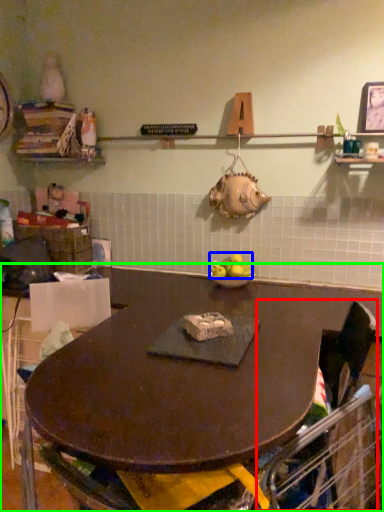
Question: Based on their relative distances, which object is farther from swivel chair (highlighted by a red box)? Choose from apple (highlighted by a blue box) and table (highlighted by a green box).

Choices:
 (A) apple
 (B) table

Answer: (A)